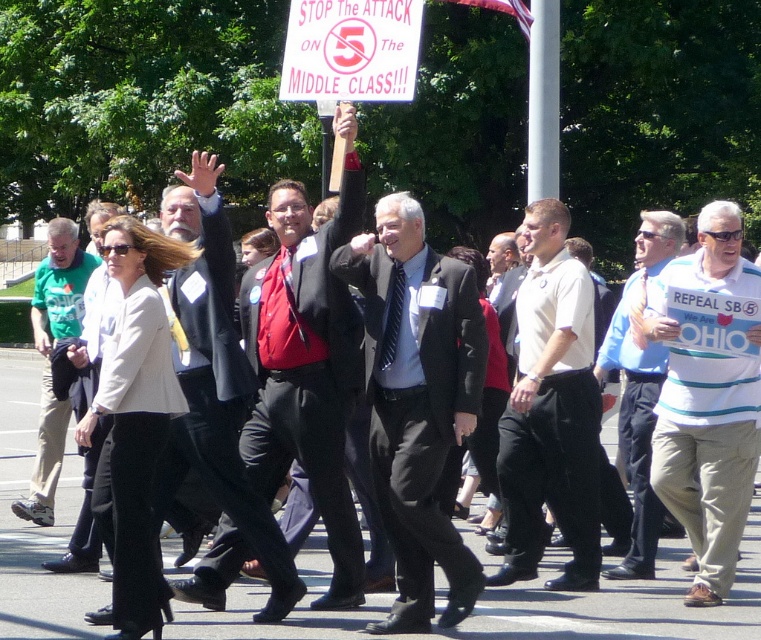
Is point (336, 109) farther from viewer compared to point (182, 364)?

Yes, point (336, 109) is farther from viewer.

Does shiny red tie at center appear on the left side of matte black suit at center?

Incorrect, shiny red tie at center is not on the left side of matte black suit at center.

This screenshot has width=761, height=640. What do you see at coordinates (307, 362) in the screenshot?
I see `shiny red tie at center` at bounding box center [307, 362].

This screenshot has width=761, height=640. Find the location of `shiny red tie at center`. shiny red tie at center is located at coordinates (307, 362).

The height and width of the screenshot is (640, 761). What do you see at coordinates (416, 401) in the screenshot? I see `dark gray suit at center` at bounding box center [416, 401].

Is dark gray suit at center closer to camera compared to shiny red tie at center?

Yes.

Between point (403, 422) and point (363, 602), which one is positioned in front?

Point (403, 422) is more forward.

Identify the location of dark gray suit at center. The image size is (761, 640). (416, 401).

Does blue striped shirt at center come behind green cotton shirt at left?

No, it is not.

Which is below, blue striped shirt at center or green cotton shirt at left?

green cotton shirt at left is below.

Where is `blue striped shirt at center`? The height and width of the screenshot is (640, 761). blue striped shirt at center is located at coordinates (639, 387).

Where is `blue striped shirt at center`? Image resolution: width=761 pixels, height=640 pixels. blue striped shirt at center is located at coordinates (639, 387).